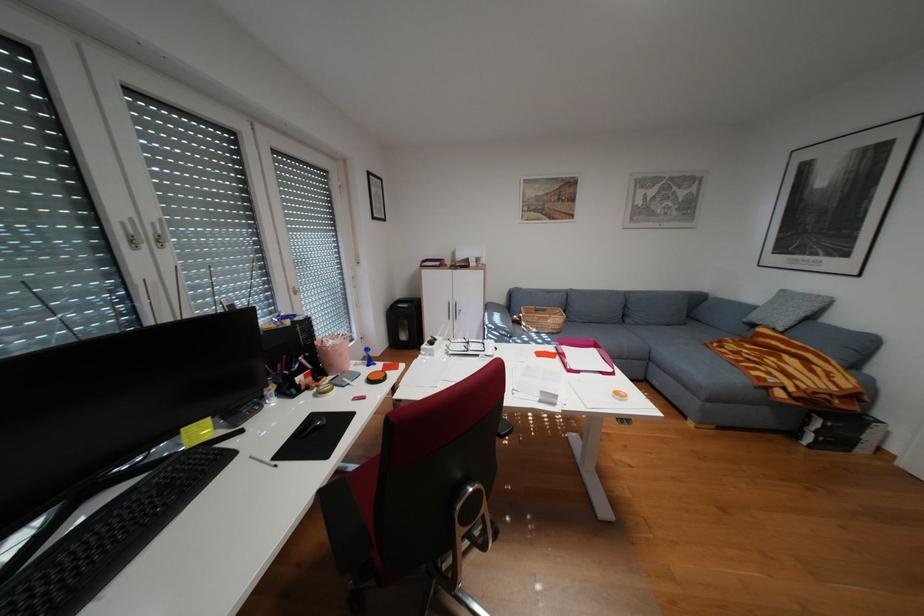
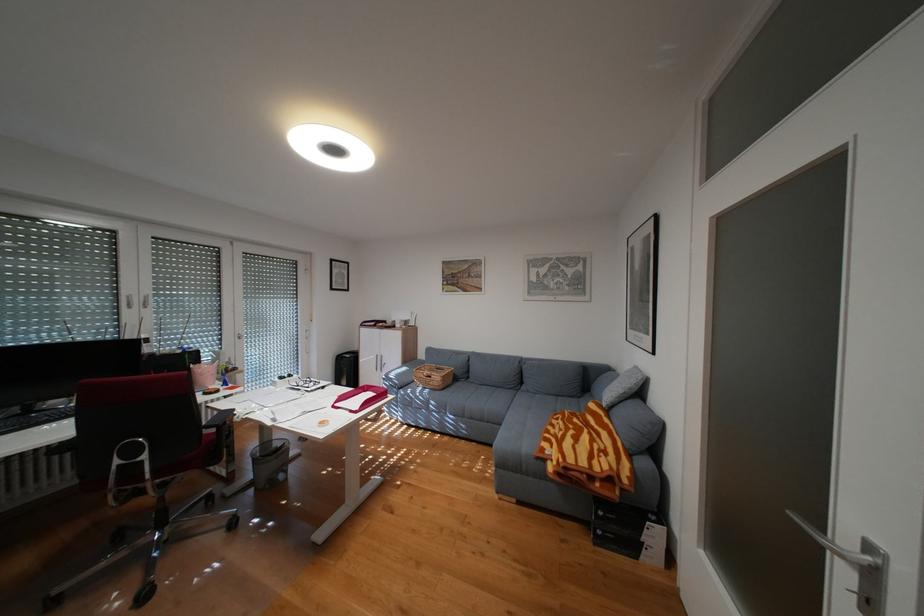
The point at (x=782, y=373) is marked in the first image. Where is the corresponding point in the second image?

(564, 445)